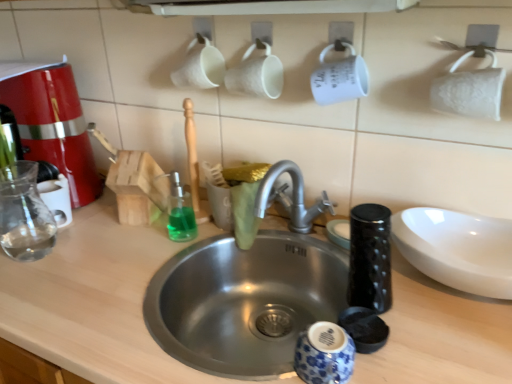
At what (x,y) coordinates should I click in order to perform the action: click on matte red coffee machine at left. Please return your answer as a coordinate pair (x, y). This screenshot has width=512, height=384. Looking at the image, I should click on (52, 123).

Measure the distance between point (x=334, y=279) and camera.

The distance of point (x=334, y=279) from camera is 3.50 feet.

What are the coordinates of `white lace toilet paper at upper right` in the screenshot? It's located at (469, 92).

The width and height of the screenshot is (512, 384). Describe the element at coordinates (24, 214) in the screenshot. I see `transparent glass bottle at left` at that location.

This screenshot has height=384, width=512. What are the coordinates of `matte red coffee machine at left` in the screenshot? It's located at point(52,123).

Is green translucent liquid at sink wider or thinner than stainless steel sink at center?

Clearly, green translucent liquid at sink has less width compared to stainless steel sink at center.

Does green translucent liquid at sink have a lesser height compared to stainless steel sink at center?

Yes.

Who is bigger, green translucent liquid at sink or stainless steel sink at center?

Bigger between the two is stainless steel sink at center.

From the image's perspective, would you say green translucent liquid at sink is shown under stainless steel sink at center?

No, from the image's perspective, green translucent liquid at sink is not below stainless steel sink at center.

Is stainless steel sink at center turned away from green translucent liquid at sink?

stainless steel sink at center does not have its back to green translucent liquid at sink.

Is green translucent liquid at sink a part of stainless steel sink at center?

Definitely not — green translucent liquid at sink is not inside stainless steel sink at center.

Which of these two, stainless steel sink at center or green translucent liquid at sink, is wider?

With larger width is stainless steel sink at center.

Consider the image. From the image's perspective, is stainless steel sink at center located above or below green translucent liquid at sink?

stainless steel sink at center is situated lower than green translucent liquid at sink in the image.

Is white lace toilet paper at upper right in front of stainless steel sink at center?

No, it is behind stainless steel sink at center.

Find the location of a particular element. The image size is (512, 384). sink that is under the white lace toilet paper at upper right (from a real-world perspective) is located at coordinates (244, 301).

Is white lace toilet paper at upper right situated inside stainless steel sink at center or outside?

white lace toilet paper at upper right cannot be found inside stainless steel sink at center.

How distant is white lace toilet paper at upper right from stainless steel sink at center?

white lace toilet paper at upper right and stainless steel sink at center are 21.95 inches apart.

Is stainless steel sink at center shorter than matte red coffee machine at left?

No, stainless steel sink at center is not shorter than matte red coffee machine at left.

Is stainless steel sink at center looking in the opposite direction of matte red coffee machine at left?

No, matte red coffee machine at left is not at the back of stainless steel sink at center.

From a real-world perspective, is stainless steel sink at center above or below matte red coffee machine at left?

→ stainless steel sink at center is below matte red coffee machine at left.

Which is more distant, (73, 309) or (19, 122)?

Positioned behind is point (19, 122).

Can you tell me how much white lace toilet paper at upper right and stainless steel sink at center differ in facing direction?

white lace toilet paper at upper right and stainless steel sink at center are facing 1.91e-05 degrees away from each other.

Choose the correct answer: Is white lace toilet paper at upper right inside stainless steel sink at center or outside it?

white lace toilet paper at upper right is spatially situated outside stainless steel sink at center.

Consider the image. Considering the relative sizes of white lace toilet paper at upper right and stainless steel sink at center in the image provided, is white lace toilet paper at upper right taller than stainless steel sink at center?

In fact, white lace toilet paper at upper right may be shorter than stainless steel sink at center.

Can you confirm if white lace toilet paper at upper right is positioned to the right of stainless steel sink at center?

Yes, white lace toilet paper at upper right is to the right of stainless steel sink at center.

Is clear glass mug at left positioned beyond the bounds of white lace toilet paper at upper right?

clear glass mug at left is positioned outside white lace toilet paper at upper right.

Between point (63, 206) and point (440, 84), which one is positioned behind?

The point (63, 206) is behind.

In terms of width, does clear glass mug at left look wider or thinner when compared to white lace toilet paper at upper right?

In the image, clear glass mug at left appears to be more narrow than white lace toilet paper at upper right.

From the image's perspective, is clear glass mug at left above or below white lace toilet paper at upper right?

clear glass mug at left is situated lower than white lace toilet paper at upper right in the image.

Between green translucent liquid at sink and clear glass mug at left, which one has larger width?

Wider between the two is clear glass mug at left.

Which of these two, green translucent liquid at sink or clear glass mug at left, is smaller?

Smaller between the two is green translucent liquid at sink.

From a real-world perspective, between green translucent liquid at sink and clear glass mug at left, who is vertically higher?

In real-world perspective, green translucent liquid at sink is above.

Does green translucent liquid at sink have a lesser height compared to clear glass mug at left?

Incorrect, the height of green translucent liquid at sink does not fall short of that of clear glass mug at left.

Where is `cleaning product on the left of the stainless steel sink at center`? This screenshot has height=384, width=512. cleaning product on the left of the stainless steel sink at center is located at coordinates (180, 212).

Identify the location of sink below the green translucent liquid at sink (from a real-world perspective). This screenshot has width=512, height=384. (244, 301).

Looking at the image, which one is located further to green translucent liquid at sink, matte red coffee machine at left or stainless steel sink at center?

matte red coffee machine at left is further to green translucent liquid at sink.

When comparing their distances from transparent glass bottle at left, does green translucent liquid at sink or clear glass mug at left seem further?

The object further to transparent glass bottle at left is green translucent liquid at sink.

Considering their positions, is matte red coffee machine at left positioned further to transparent glass bottle at left than clear glass mug at left?

matte red coffee machine at left lies further to transparent glass bottle at left than the other object.

Which object lies nearer to the anchor point matte red coffee machine at left, clear glass mug at left or stainless steel sink at center?

Based on the image, clear glass mug at left appears to be nearer to matte red coffee machine at left.

Which object lies nearer to the anchor point matte red coffee machine at left, stainless steel sink at center or transparent glass bottle at left?

transparent glass bottle at left lies closer to matte red coffee machine at left than the other object.

From the image, which object appears to be nearer to stainless steel sink at center, clear glass mug at left or green translucent liquid at sink?

Among the two, green translucent liquid at sink is located nearer to stainless steel sink at center.

Considering their positions, is stainless steel sink at center positioned further to green translucent liquid at sink than clear glass mug at left?

The object further to green translucent liquid at sink is clear glass mug at left.

When comparing their distances from transparent glass bottle at left, does stainless steel sink at center or matte red coffee machine at left seem closer?

matte red coffee machine at left is closer to transparent glass bottle at left.

Identify the location of mug located between matte red coffee machine at left and white lace toilet paper at upper right in the left-right direction. (57, 199).

You are a GUI agent. You are given a task and a screenshot of the screen. Output one action in this format:
    pyautogui.click(x=<x>, y=<y>)
    Task: Click on the cleaning product situated between transparent glass bottle at left and white lace toilet paper at upper right from left to right
    
    Given the screenshot: What is the action you would take?
    pyautogui.click(x=180, y=212)

You are a GUI agent. You are given a task and a screenshot of the screen. Output one action in this format:
    pyautogui.click(x=<x>, y=<y>)
    Task: Click on the cleaning product situated between matte red coffee machine at left and white lace toilet paper at upper right from left to right
    The height and width of the screenshot is (384, 512).
    Given the screenshot: What is the action you would take?
    pyautogui.click(x=180, y=212)

Identify the location of cleaning product between stainless steel sink at center and clear glass mug at left from front to back. This screenshot has height=384, width=512. (180, 212).